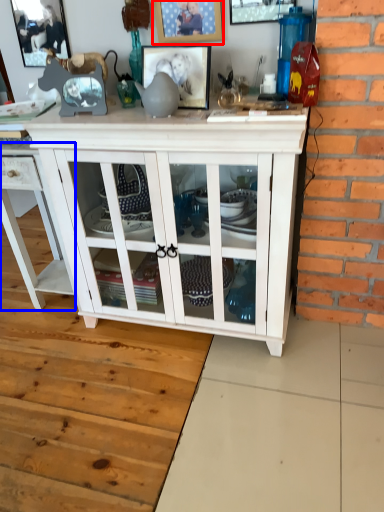
Question: Which of the following is the farthest to the observer, picture frame (highlighted by a red box) or cabinetry (highlighted by a blue box)?

Choices:
 (A) picture frame
 (B) cabinetry

Answer: (B)